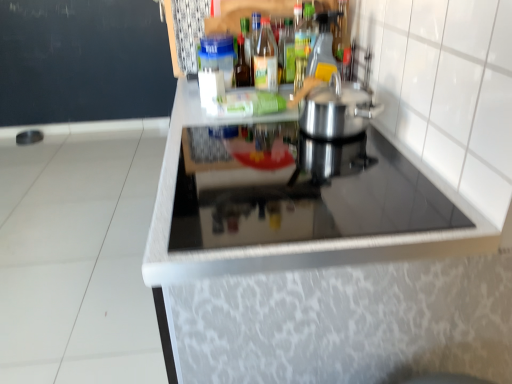
Question: Considering the relative sizes of satin silver pot at center and transparent glass bottle at upper center, which is the fifth bottle in left-to-right order, in the image provided, is satin silver pot at center bigger than transparent glass bottle at upper center, which is the fifth bottle in left-to-right order,?

Choices:
 (A) yes
 (B) no

Answer: (A)

Question: Is satin silver pot at center positioned beyond the bounds of transparent glass bottle at upper center, which is the fifth bottle in left-to-right order?

Choices:
 (A) yes
 (B) no

Answer: (A)

Question: Is satin silver pot at center thinner than transparent glass bottle at upper center, which is the 1th bottle from right to left?

Choices:
 (A) yes
 (B) no

Answer: (B)

Question: Considering the relative sizes of satin silver pot at center and transparent glass bottle at upper center, which is the 1th bottle from right to left, in the image provided, is satin silver pot at center wider than transparent glass bottle at upper center, which is the 1th bottle from right to left,?

Choices:
 (A) no
 (B) yes

Answer: (B)

Question: Is satin silver pot at center smaller than transparent glass bottle at upper center, which is the 1th bottle from right to left?

Choices:
 (A) yes
 (B) no

Answer: (B)

Question: From the image's perspective, is satin silver pot at center under transparent glass bottle at upper center, which is the 1th bottle from right to left?

Choices:
 (A) no
 (B) yes

Answer: (B)

Question: Can we say black glass cooktop at center lies outside satin silver pot at center?

Choices:
 (A) no
 (B) yes

Answer: (B)

Question: Is there a large distance between black glass cooktop at center and satin silver pot at center?

Choices:
 (A) yes
 (B) no

Answer: (B)

Question: Is black glass cooktop at center to the right of satin silver pot at center from the viewer's perspective?

Choices:
 (A) yes
 (B) no

Answer: (B)

Question: Is satin silver pot at center a part of black glass cooktop at center?

Choices:
 (A) yes
 (B) no

Answer: (B)

Question: Is black glass cooktop at center closer to the viewer compared to satin silver pot at center?

Choices:
 (A) no
 (B) yes

Answer: (B)

Question: From the image's perspective, does black glass cooktop at center appear higher than satin silver pot at center?

Choices:
 (A) no
 (B) yes

Answer: (A)

Question: Does black glass cooktop at center lie in front of translucent plastic bottle at upper center, the 4th bottle in the right-to-left sequence?

Choices:
 (A) no
 (B) yes

Answer: (B)